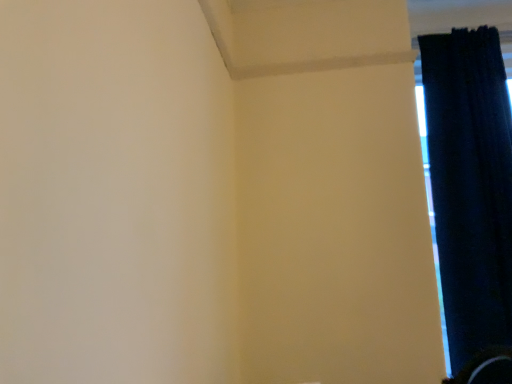
Locate an element on the screen. This screenshot has height=384, width=512. dark blue fabric curtain at right is located at coordinates (470, 185).

Measure the distance between point (461, 188) and camera.

Point (461, 188) and camera are 2.00 meters apart.

Describe the element at coordinates (470, 185) in the screenshot. This screenshot has height=384, width=512. I see `dark blue fabric curtain at right` at that location.

In order to click on dark blue fabric curtain at right in this screenshot , I will do `click(470, 185)`.